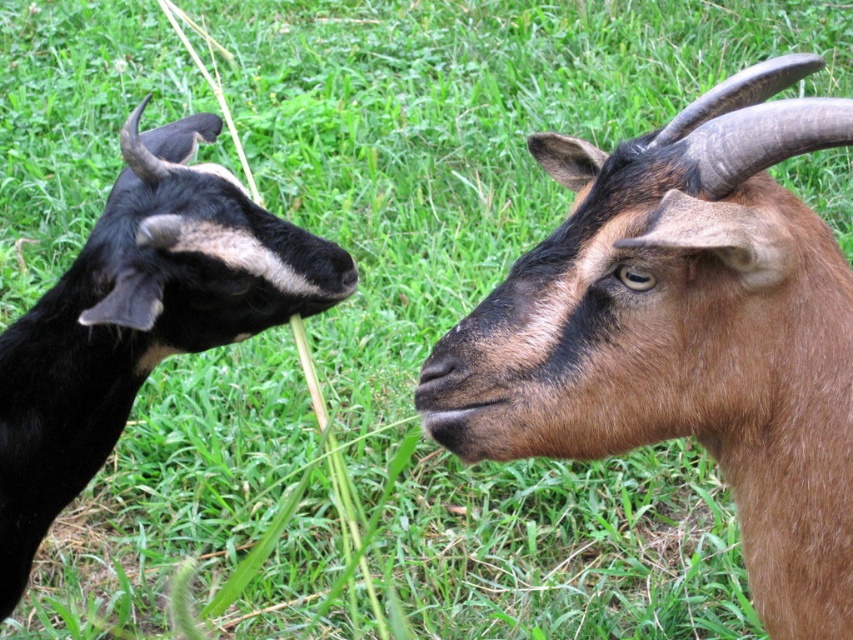
Question: Can you confirm if brown furry goat at right is positioned to the right of black fur goat at left?

Choices:
 (A) yes
 (B) no

Answer: (A)

Question: Among these points, which one is nearest to the camera?

Choices:
 (A) (523, 321)
 (B) (287, 275)

Answer: (A)

Question: Can you confirm if brown furry goat at right is positioned to the left of black fur goat at left?

Choices:
 (A) yes
 (B) no

Answer: (B)

Question: Can you confirm if brown furry goat at right is positioned below black fur goat at left?

Choices:
 (A) no
 (B) yes

Answer: (A)